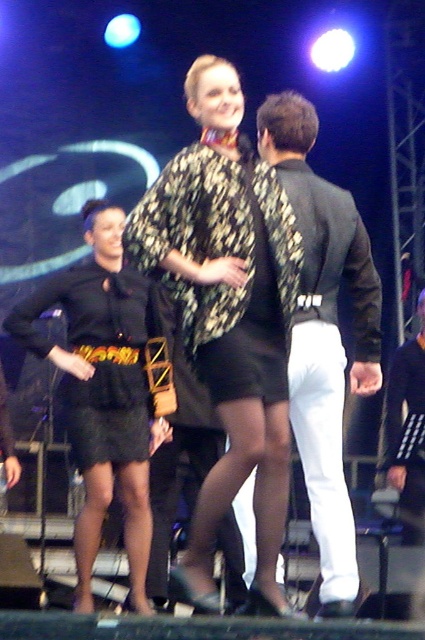
Question: Which point is farther from the camera taking this photo?

Choices:
 (A) [x=209, y=321]
 (B) [x=147, y=518]
 (C) [x=309, y=481]

Answer: (B)

Question: Observing the image, what is the correct spatial positioning of printed fabric cape at center in reference to black leather dress at left?

Choices:
 (A) right
 (B) left

Answer: (A)

Question: Which object appears farthest from the camera in this image?

Choices:
 (A) black leather dress at left
 (B) shiny black jacket at center
 (C) printed fabric cape at center

Answer: (A)

Question: Is printed fabric cape at center to the right of black leather dress at left from the viewer's perspective?

Choices:
 (A) yes
 (B) no

Answer: (A)

Question: Does printed fabric cape at center appear over shiny black jacket at center?

Choices:
 (A) yes
 (B) no

Answer: (A)

Question: Which of the following is the farthest from the observer?

Choices:
 (A) shiny black jacket at center
 (B) printed fabric cape at center
 (C) black leather dress at left

Answer: (C)